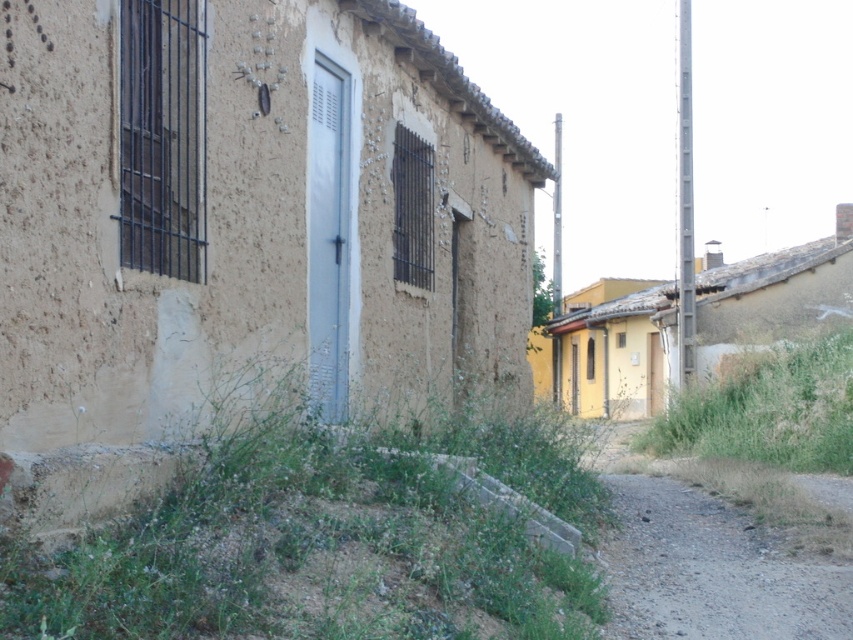
Which is above, green grass at lower center or gray gravel path at lower right?

Positioned higher is green grass at lower center.

Is green grass at lower center to the left of gray gravel path at lower right from the viewer's perspective?

Yes, green grass at lower center is to the left of gray gravel path at lower right.

Locate an element on the screen. The width and height of the screenshot is (853, 640). green grass at lower center is located at coordinates (331, 541).

Find the location of a particular element. The image size is (853, 640). green grass at lower center is located at coordinates (331, 541).